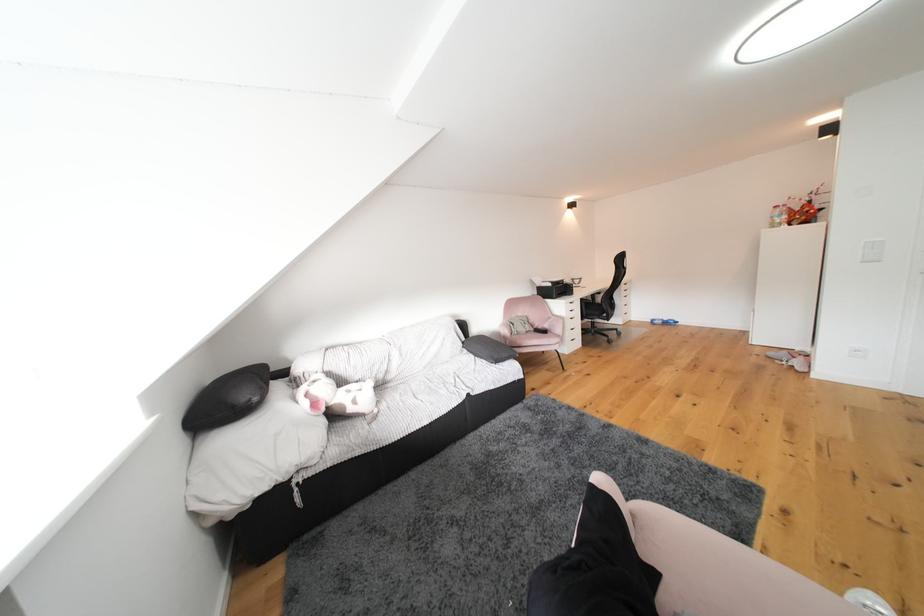
Describe the element at coordinates (536, 339) in the screenshot. This screenshot has height=616, width=924. I see `the pink chair sitting surface` at that location.